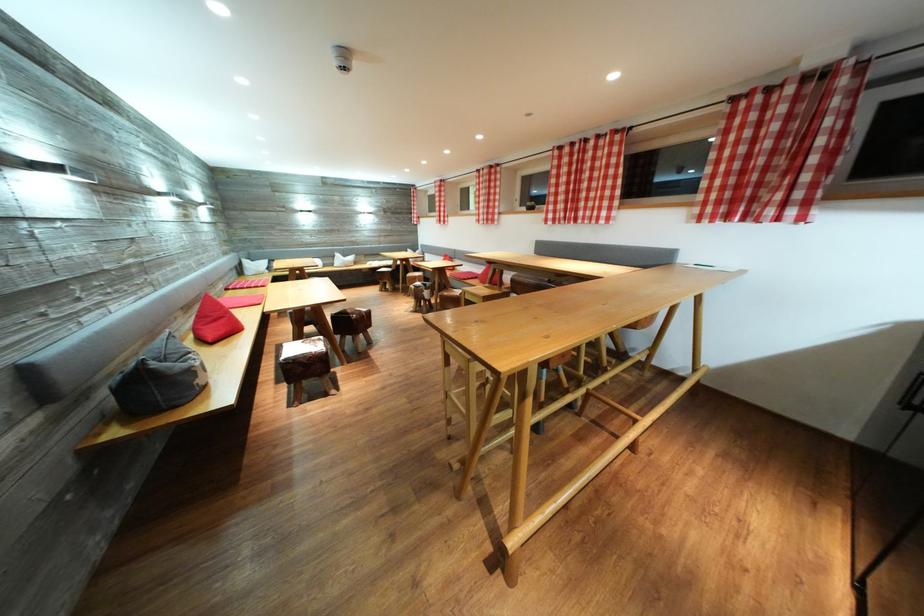
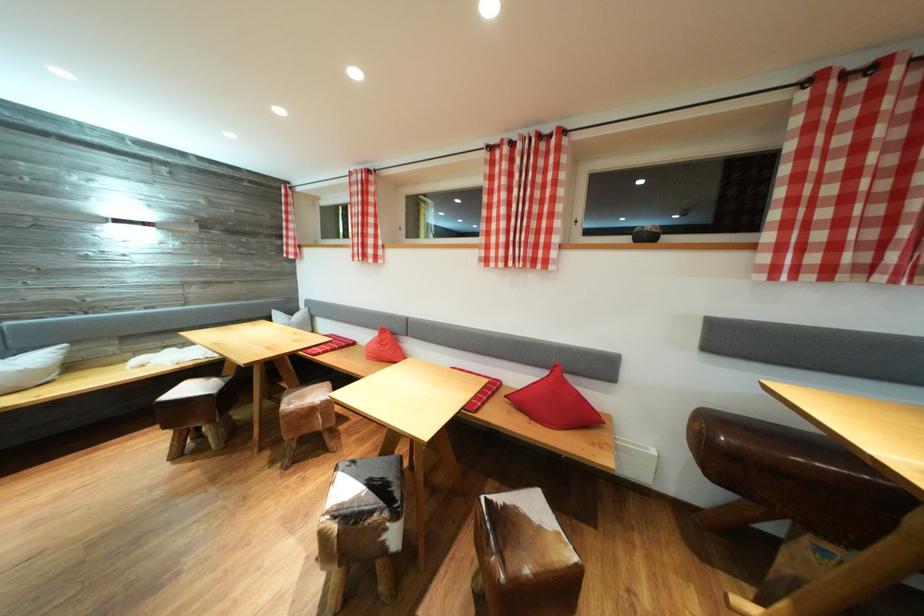
Where in the second image is the point corresponding to (x=485, y=225) from the first image?

(492, 265)